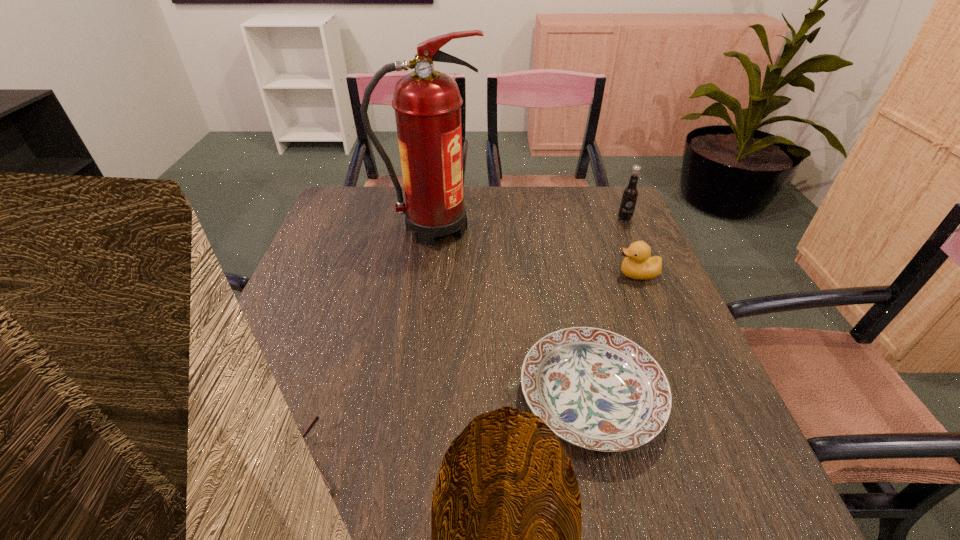
You are a GUI agent. You are given a task and a screenshot of the screen. Output one action in this format:
    pyautogui.click(x=<x>, y=<y>)
    Task: Click on the object that is positioned at the far right corner
    The width and height of the screenshot is (960, 540).
    Given the screenshot: What is the action you would take?
    pyautogui.click(x=630, y=194)

In the image, there is a desktop. At what (x,y) coordinates should I click in order to perform the action: click on vacant space at the far edge. Please return your answer as a coordinate pair (x, y). Looking at the image, I should click on (471, 225).

This screenshot has width=960, height=540. I want to click on vacant space at the near edge of the desktop, so click(437, 493).

Locate an element on the screen. vacant region at the left edge is located at coordinates (322, 260).

Image resolution: width=960 pixels, height=540 pixels. I want to click on vacant space at the right edge, so click(x=725, y=432).

What are the coordinates of `free region at the far left corner` in the screenshot? It's located at (370, 219).

Where is `vacant region between the spectacles and the third shortest object`? Image resolution: width=960 pixels, height=540 pixels. vacant region between the spectacles and the third shortest object is located at coordinates (466, 369).

Image resolution: width=960 pixels, height=540 pixels. I want to click on free space that is in between the third tallest object and the fire extinguisher, so click(x=536, y=251).

Where is `empty location between the plate and the spectacles`? The image size is (960, 540). empty location between the plate and the spectacles is located at coordinates (442, 430).

Where is `free space between the spectacles and the duckling`? free space between the spectacles and the duckling is located at coordinates (466, 369).